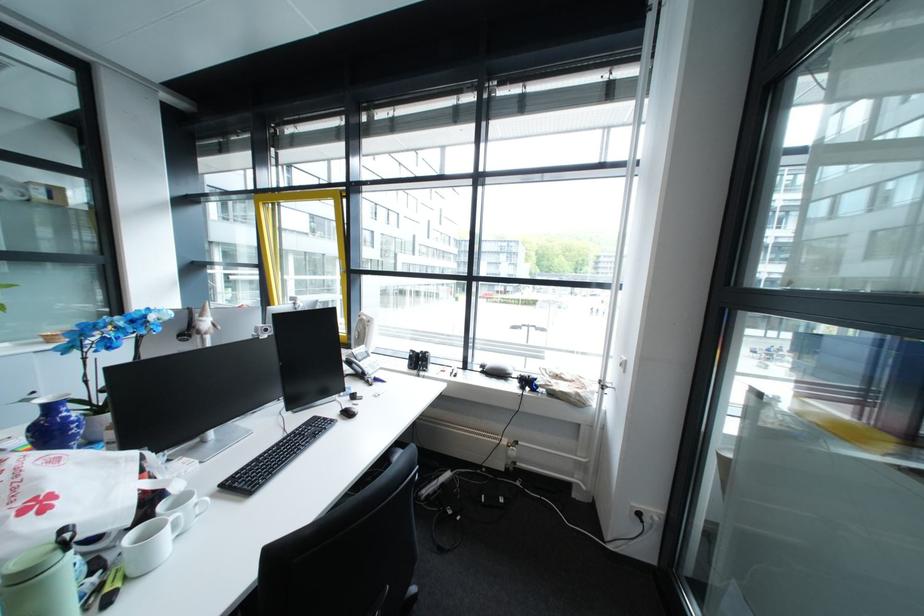
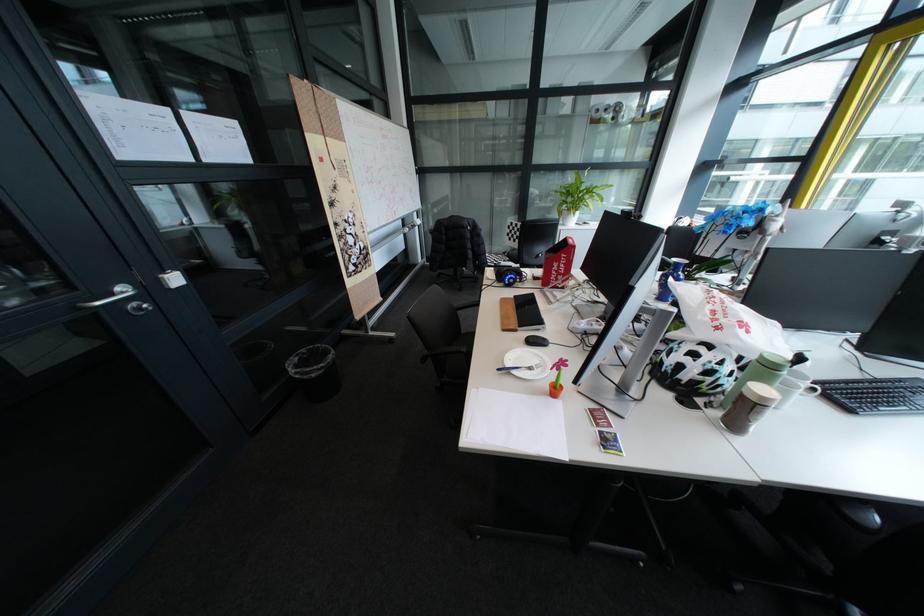
Where in the second image is the point corresponding to point 186,517 from the first image?

(815, 386)